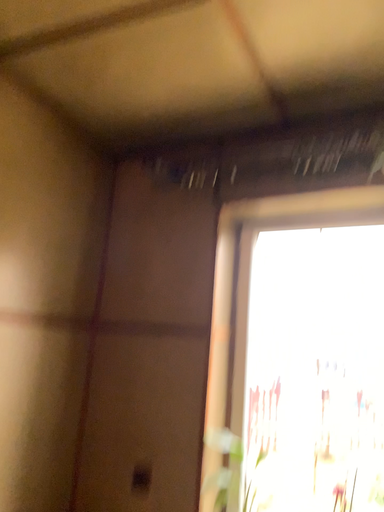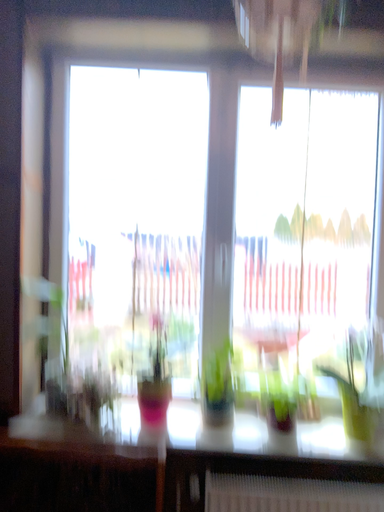
Question: How did the camera likely rotate when shooting the video?

Choices:
 (A) rotated left
 (B) rotated right

Answer: (B)